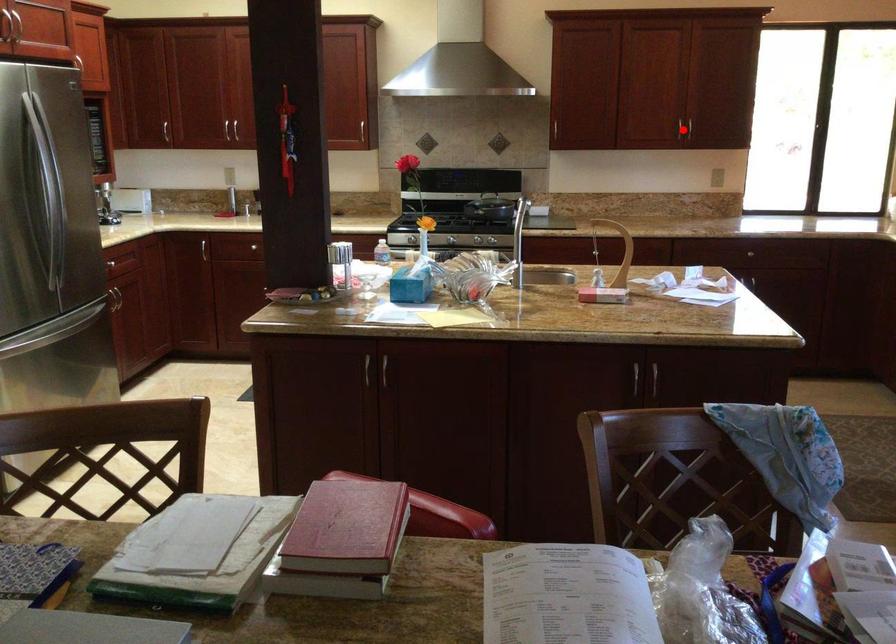
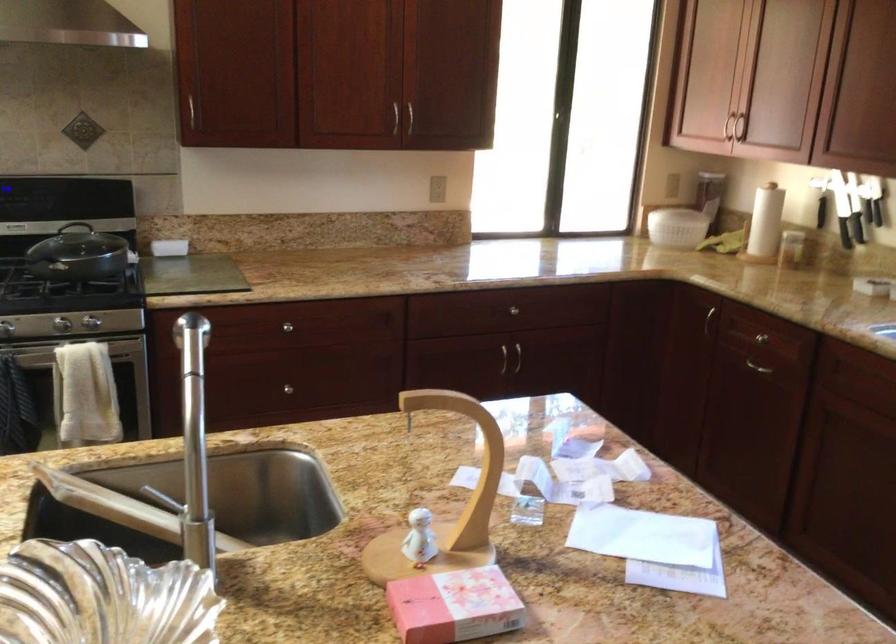
Question: I am providing you with two images of the same scene from different viewpoints. A red point is marked on the first image. At the location where the point appears in image 1, is it still visible in image 2?

Choices:
 (A) Yes
 (B) No

Answer: (B)